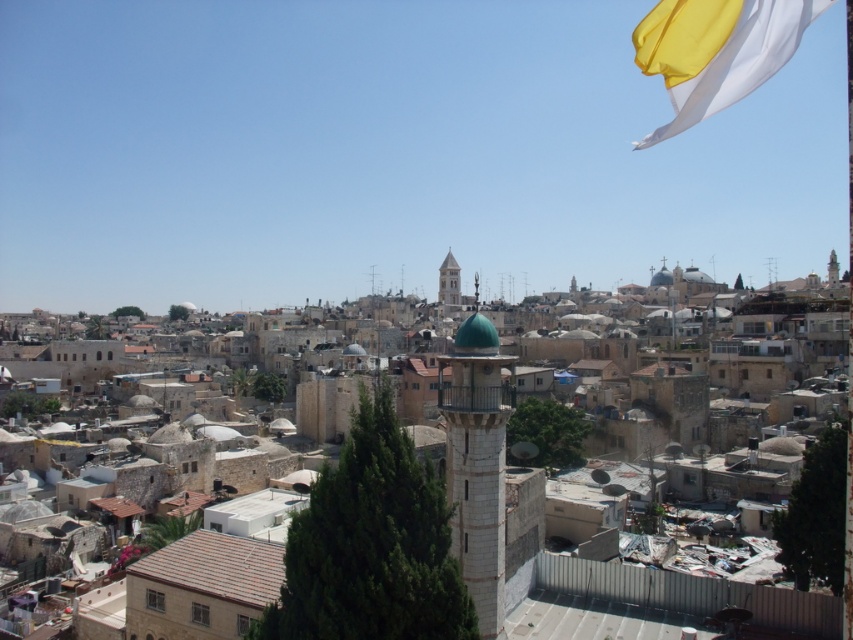
Measure the distance between point (757, 616) and camera.

Point (757, 616) is 86.89 meters from camera.

Consider the image. Which is below, stone minaret at center or light beige stone tower at center?

stone minaret at center is lower down.

You are a GUI agent. You are given a task and a screenshot of the screen. Output one action in this format:
    pyautogui.click(x=<x>, y=<y>)
    Task: Click on the stone minaret at center
    This screenshot has width=853, height=640.
    Given the screenshot: What is the action you would take?
    pyautogui.click(x=477, y=465)

Where is `white silky flag at upper right`? white silky flag at upper right is located at coordinates (717, 51).

Which is in front, point (662, 3) or point (445, 275)?

Positioned in front is point (662, 3).

You are a GUI agent. You are given a task and a screenshot of the screen. Output one action in this format:
    pyautogui.click(x=<x>, y=<y>)
    Task: Click on the white silky flag at upper right
    This screenshot has width=853, height=640.
    Given the screenshot: What is the action you would take?
    pyautogui.click(x=717, y=51)

Which is more to the right, white stone tower at center or light beige stone tower at center?

light beige stone tower at center

Based on the photo, is white stone tower at center to the left of light beige stone tower at center from the viewer's perspective?

Indeed, white stone tower at center is positioned on the left side of light beige stone tower at center.

Does point (474, 371) lie behind point (453, 257)?

No, it is in front of (453, 257).

The height and width of the screenshot is (640, 853). I want to click on white stone tower at center, so click(x=477, y=461).